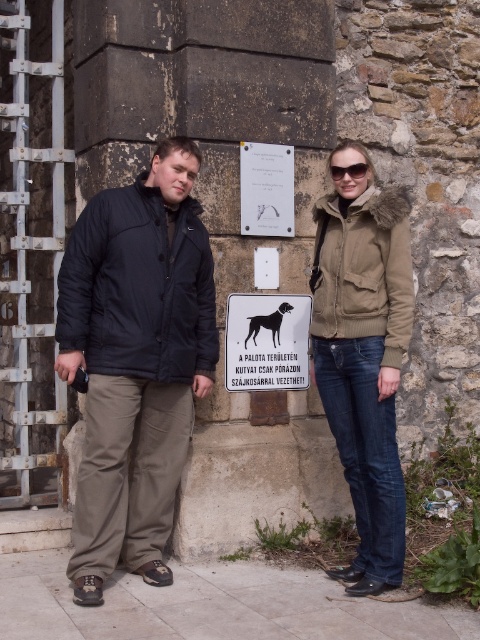
Consider the image. Is black plastic sign at center shorter than sunglasses at center?

No.

Who is lower down, black plastic sign at center or sunglasses at center?

Positioned lower is black plastic sign at center.

Image resolution: width=480 pixels, height=640 pixels. What do you see at coordinates (266, 340) in the screenshot? I see `black plastic sign at center` at bounding box center [266, 340].

Where is `black plastic sign at center`? black plastic sign at center is located at coordinates (266, 340).

Can you confirm if dark blue puffy jacket at center is bigger than black plastic sign at center?

Indeed, dark blue puffy jacket at center has a larger size compared to black plastic sign at center.

What do you see at coordinates (135, 362) in the screenshot? I see `dark blue puffy jacket at center` at bounding box center [135, 362].

What do you see at coordinates (135, 362) in the screenshot? The width and height of the screenshot is (480, 640). I see `dark blue puffy jacket at center` at bounding box center [135, 362].

Where is `dark blue puffy jacket at center`? dark blue puffy jacket at center is located at coordinates (135, 362).

Who is lower down, dark blue puffy jacket at center or dark blue jacket at center?

dark blue jacket at center is below.

Can you confirm if dark blue puffy jacket at center is wider than dark blue jacket at center?

Correct, the width of dark blue puffy jacket at center exceeds that of dark blue jacket at center.

Between point (132, 397) and point (94, 604), which one is positioned behind?

The point (132, 397) is more distant.

I want to click on dark blue puffy jacket at center, so click(x=135, y=362).